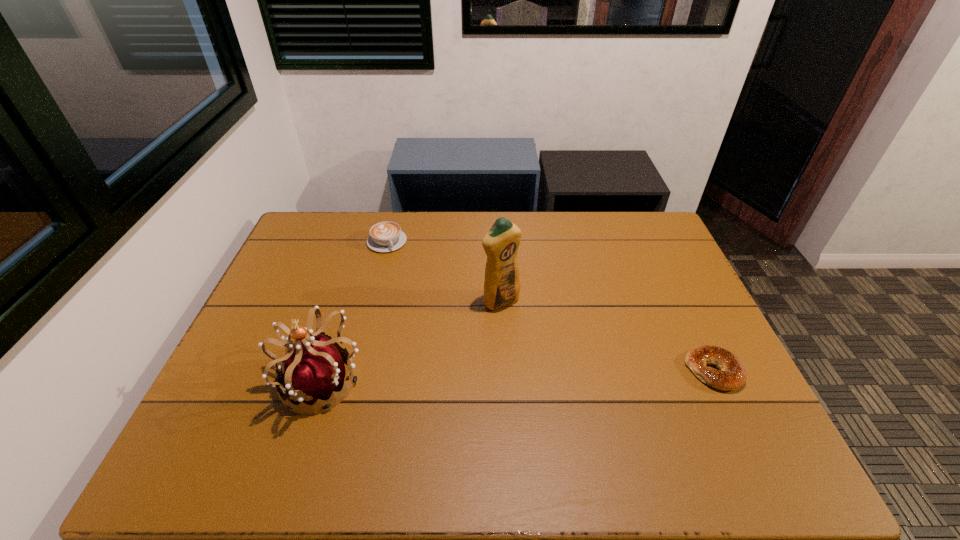
Find the location of a particular element. vacant space that's between the detergent and the shortest object is located at coordinates (607, 336).

Where is `blank region between the third shortest object and the cappuccino`? The width and height of the screenshot is (960, 540). blank region between the third shortest object and the cappuccino is located at coordinates (354, 312).

Where is `vacant space in between the tiara and the cappuccino`? The width and height of the screenshot is (960, 540). vacant space in between the tiara and the cappuccino is located at coordinates (354, 312).

Locate an element on the screen. vacant space that is in between the cappuccino and the tallest object is located at coordinates (x=444, y=272).

The image size is (960, 540). I want to click on vacant point located between the tallest object and the second tallest object, so click(412, 341).

At what (x,y) coordinates should I click in order to perform the action: click on vacant area that lies between the second tallest object and the second shortest object. Please return your answer as a coordinate pair (x, y). Looking at the image, I should click on (354, 312).

Identify which object is located as the second nearest to the bagel. Please provide its 2D coordinates. Your answer should be formatted as a tuple, i.e. [(x, y)], where the tuple contains the x and y coordinates of a point satisfying the conditions above.

[(314, 370)]

At what (x,y) coordinates should I click in order to perform the action: click on object that stands as the second closest to the cappuccino. Please return your answer as a coordinate pair (x, y). The width and height of the screenshot is (960, 540). Looking at the image, I should click on (314, 370).